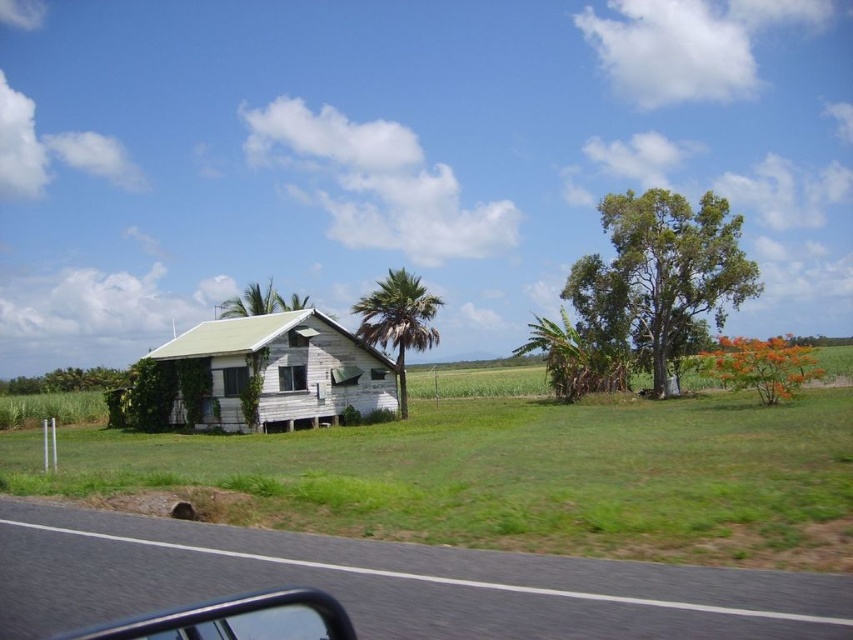
Question: Can you confirm if weathered wood house at left is wider than green leafy palm tree at center?

Choices:
 (A) yes
 (B) no

Answer: (A)

Question: Where is green leafy tree at upper right located in relation to transparent glass car window at lower left in the image?

Choices:
 (A) right
 (B) left

Answer: (A)

Question: Which of the following is the farthest from the observer?

Choices:
 (A) green leafy tree at upper right
 (B) green leafy palm tree at center
 (C) transparent glass window at center
 (D) green leafy tree at left

Answer: (A)

Question: Which point is closer to the camera taking this photo?

Choices:
 (A) (553, 506)
 (B) (137, 525)
 (C) (231, 368)
 (D) (65, 381)

Answer: (B)

Question: Among these objects, which one is farthest from the camera?

Choices:
 (A) transparent glass car window at lower left
 (B) weathered wood house at left
 (C) green leafy palm tree at center

Answer: (C)

Question: Is black asphalt road at lower left bigger than green leafy tree at left?

Choices:
 (A) no
 (B) yes

Answer: (A)